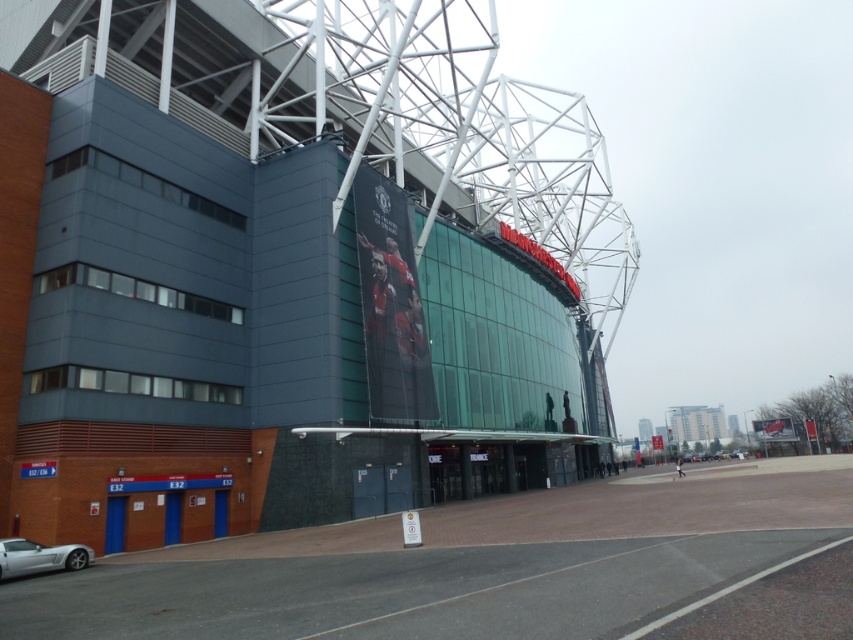
You are a photographer trying to capture the dark gray concrete stadium at center and the silver metallic car at lower left in a single frame. Which object should you focus on first if you want to ensure both are in the frame without moving the camera?

You should focus on the dark gray concrete stadium at center first because it is wider than the silver metallic car at lower left, so centering it will help include both in the frame.

Looking at this image, you are standing at the origin point in a coordinate system where the stadium is placed at coordinates given in the description. If you want to move directly towards the dark gray concrete stadium at center, which direction should you head?

Since the dark gray concrete stadium at center is located at point (x=291, y=266) in the coordinate system, you should move in the direction of increasing both x and y coordinates to reach it.

You are a photographer trying to capture both the dark gray concrete stadium at center and the silver metallic car at lower left in a single frame. Considering their sizes, which object should you focus on to ensure both are visible without cropping?

The dark gray concrete stadium at center is bigger than the silver metallic car at lower left, so you should focus on the silver metallic car at lower left to ensure both are visible without cropping.